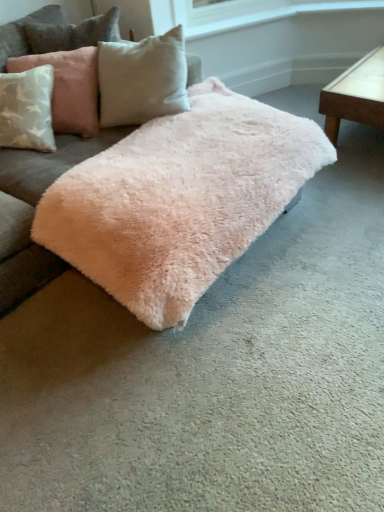
Question: From a real-world perspective, relative to fuzzy pink rug at center, is light pink plush pillow at upper left vertically above or below?

Choices:
 (A) above
 (B) below

Answer: (A)

Question: In the image, is light pink plush pillow at upper left on the left side or the right side of fuzzy pink rug at center?

Choices:
 (A) right
 (B) left

Answer: (B)

Question: Which object is positioned closest to the light brown wooden table at right?

Choices:
 (A) fuzzy pink rug at center
 (B) light pink plush pillow at upper left

Answer: (A)

Question: Considering the real-world distances, which object is closest to the light pink plush pillow at upper left?

Choices:
 (A) light brown wooden table at right
 (B) fuzzy pink rug at center

Answer: (B)